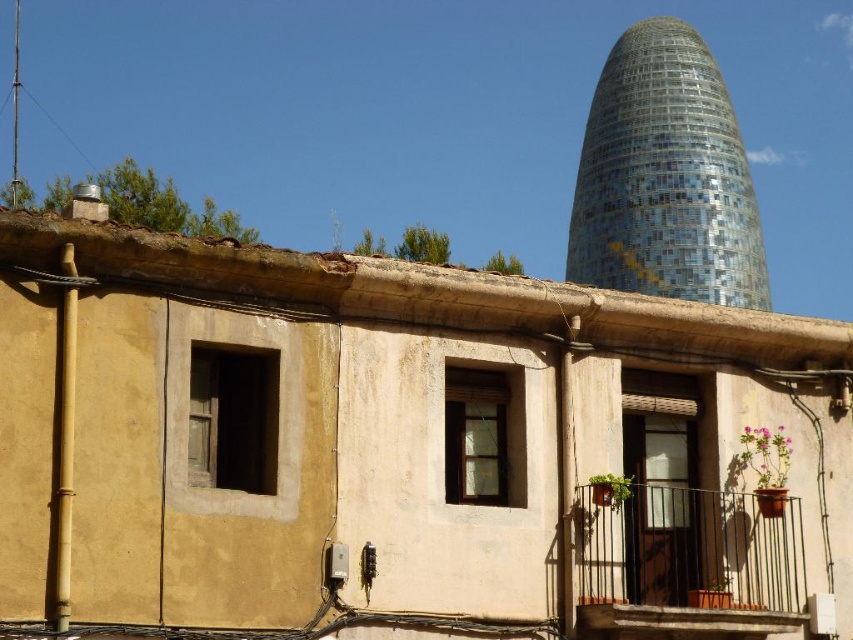
You are standing in front of the traditional building and want to know which of the two points, point (x=637, y=186) or point (x=717, y=579), is closer to you. Based on the scene description, which point is nearer?

Point (x=637, y=186) is further to the viewer than point (x=717, y=579). Wait, the description says the opposite. Let me check again. The Objects Description states that point (x=637, y=186) is further to the viewer than point (x=717, y=579). Therefore, the closer point to you would be point (x=717, y=579).